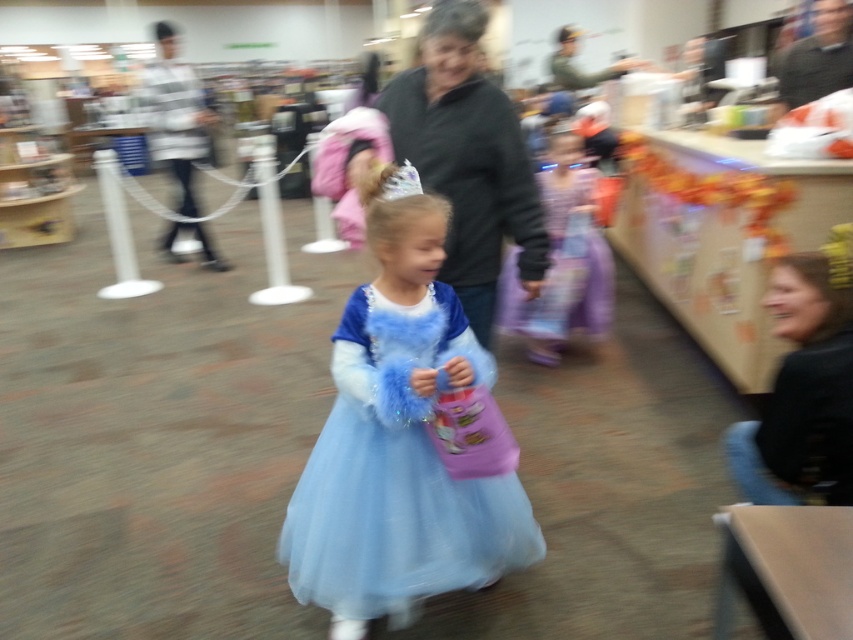
Question: Does dark gray sweater at center have a lesser width compared to purple satin dress at center?

Choices:
 (A) yes
 (B) no

Answer: (A)

Question: Among these objects, which one is farthest from the camera?

Choices:
 (A) dark gray sweater at center
 (B) light blue tulle dress at center
 (C) purple satin dress at center

Answer: (C)

Question: Which object is positioned farthest from the light blue tulle dress at center?

Choices:
 (A) purple satin dress at center
 (B) dark gray sweater at center

Answer: (A)

Question: Does light blue tulle dress at center have a larger size compared to purple satin dress at center?

Choices:
 (A) yes
 (B) no

Answer: (B)

Question: Which object is the closest to the dark gray sweater at center?

Choices:
 (A) light blue tulle dress at center
 (B) purple satin dress at center

Answer: (A)

Question: Does light blue tulle dress at center have a greater width compared to purple satin dress at center?

Choices:
 (A) no
 (B) yes

Answer: (B)